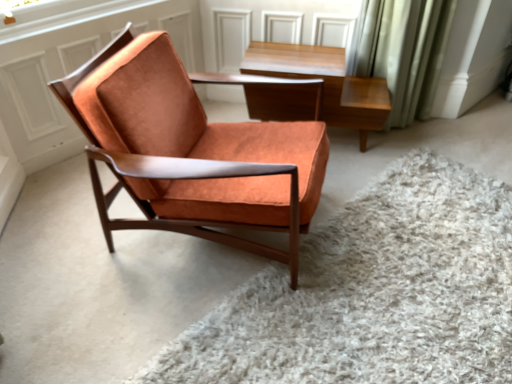
Question: Can you confirm if orange suede chair at center is shorter than light brown wood table at upper center?

Choices:
 (A) yes
 (B) no

Answer: (A)

Question: From the image's perspective, is orange suede chair at center below light brown wood table at upper center?

Choices:
 (A) yes
 (B) no

Answer: (A)

Question: Is orange suede chair at center in contact with light brown wood table at upper center?

Choices:
 (A) yes
 (B) no

Answer: (B)

Question: Is orange suede chair at center not close to light brown wood table at upper center?

Choices:
 (A) yes
 (B) no

Answer: (B)

Question: Considering the relative sizes of orange suede chair at center and light brown wood table at upper center in the image provided, is orange suede chair at center taller than light brown wood table at upper center?

Choices:
 (A) no
 (B) yes

Answer: (A)

Question: Considering the relative sizes of orange suede chair at center and light brown wood table at upper center in the image provided, is orange suede chair at center smaller than light brown wood table at upper center?

Choices:
 (A) yes
 (B) no

Answer: (A)

Question: From a real-world perspective, is light brown wood table at upper center positioned over suede orange chair at center based on gravity?

Choices:
 (A) yes
 (B) no

Answer: (B)

Question: Is light brown wood table at upper center closer to the viewer compared to suede orange chair at center?

Choices:
 (A) no
 (B) yes

Answer: (A)

Question: From the image's perspective, would you say light brown wood table at upper center is shown under suede orange chair at center?

Choices:
 (A) no
 (B) yes

Answer: (A)

Question: Is light brown wood table at upper center turned away from suede orange chair at center?

Choices:
 (A) no
 (B) yes

Answer: (A)

Question: Is light brown wood table at upper center smaller than suede orange chair at center?

Choices:
 (A) yes
 (B) no

Answer: (A)

Question: Does light brown wood table at upper center lie behind suede orange chair at center?

Choices:
 (A) no
 (B) yes

Answer: (B)

Question: Can suede orange chair at center be found inside orange suede chair at center?

Choices:
 (A) no
 (B) yes

Answer: (A)